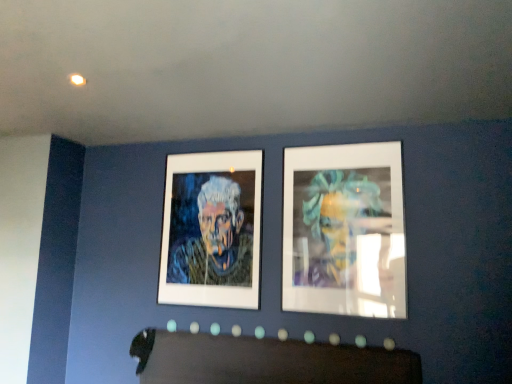
Question: Considering the relative positions of oil painting portrait at center and white matte picture frame at upper right in the image provided, is oil painting portrait at center to the right of white matte picture frame at upper right from the viewer's perspective?

Choices:
 (A) yes
 (B) no

Answer: (B)

Question: Is oil painting portrait at center shorter than white matte picture frame at upper right?

Choices:
 (A) no
 (B) yes

Answer: (B)

Question: Is oil painting portrait at center further to camera compared to white matte picture frame at upper right?

Choices:
 (A) no
 (B) yes

Answer: (B)

Question: Is oil painting portrait at center surrounding white matte picture frame at upper right?

Choices:
 (A) no
 (B) yes

Answer: (A)

Question: From a real-world perspective, is oil painting portrait at center over white matte picture frame at upper right?

Choices:
 (A) yes
 (B) no

Answer: (B)

Question: Does oil painting portrait at center come in front of white matte picture frame at upper right?

Choices:
 (A) no
 (B) yes

Answer: (A)

Question: Is white matte picture frame at upper right at the right side of oil painting portrait at center?

Choices:
 (A) no
 (B) yes

Answer: (B)

Question: From a real-world perspective, is white matte picture frame at upper right under oil painting portrait at center?

Choices:
 (A) no
 (B) yes

Answer: (A)

Question: Does white matte picture frame at upper right come behind oil painting portrait at center?

Choices:
 (A) no
 (B) yes

Answer: (A)

Question: From the image's perspective, does white matte picture frame at upper right appear higher than oil painting portrait at center?

Choices:
 (A) yes
 (B) no

Answer: (A)

Question: Can you confirm if white matte picture frame at upper right is shorter than oil painting portrait at center?

Choices:
 (A) yes
 (B) no

Answer: (B)

Question: From a real-world perspective, is white matte picture frame at upper right located higher than oil painting portrait at center?

Choices:
 (A) yes
 (B) no

Answer: (A)

Question: From a real-world perspective, is white matte picture frame at upper right above or below oil painting portrait at center?

Choices:
 (A) below
 (B) above

Answer: (B)